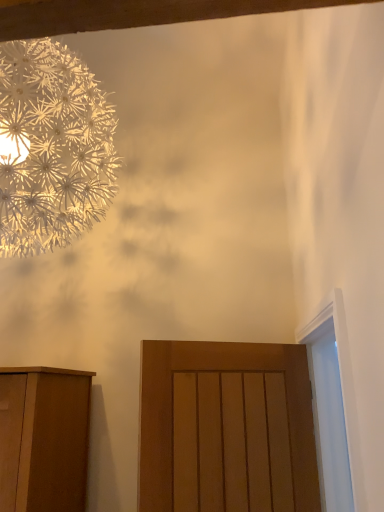
Question: Can we say metallic silver flower at upper left lies outside matte wood door at center?

Choices:
 (A) yes
 (B) no

Answer: (A)

Question: Can you confirm if metallic silver flower at upper left is wider than matte wood door at center?

Choices:
 (A) no
 (B) yes

Answer: (B)

Question: Considering the relative positions of metallic silver flower at upper left and matte wood door at center in the image provided, is metallic silver flower at upper left to the left of matte wood door at center from the viewer's perspective?

Choices:
 (A) no
 (B) yes

Answer: (B)

Question: Could you tell me if metallic silver flower at upper left is turned towards matte wood door at center?

Choices:
 (A) yes
 (B) no

Answer: (B)

Question: Is metallic silver flower at upper left to the right of matte wood door at center from the viewer's perspective?

Choices:
 (A) yes
 (B) no

Answer: (B)

Question: Looking at their shapes, would you say metallic silver flower at upper left is wider or thinner than matte wood door at center?

Choices:
 (A) thin
 (B) wide

Answer: (B)

Question: Visually, is metallic silver flower at upper left positioned to the left or to the right of matte wood door at center?

Choices:
 (A) right
 (B) left

Answer: (B)

Question: From the image's perspective, is metallic silver flower at upper left above or below matte wood door at center?

Choices:
 (A) below
 (B) above

Answer: (B)

Question: Is metallic silver flower at upper left bigger or smaller than matte wood door at center?

Choices:
 (A) small
 (B) big

Answer: (B)

Question: Looking at their shapes, would you say matte wood door at center is wider or thinner than metallic silver flower at upper left?

Choices:
 (A) wide
 (B) thin

Answer: (B)

Question: Would you say matte wood door at center is inside or outside metallic silver flower at upper left?

Choices:
 (A) inside
 (B) outside

Answer: (B)

Question: In the image, is matte wood door at center positioned in front of or behind metallic silver flower at upper left?

Choices:
 (A) behind
 (B) front

Answer: (A)

Question: Is matte wood door at center to the left or to the right of metallic silver flower at upper left in the image?

Choices:
 (A) right
 (B) left

Answer: (A)

Question: Is white glossy door at right wider or thinner than metallic silver flower at upper left?

Choices:
 (A) thin
 (B) wide

Answer: (A)

Question: In terms of size, does white glossy door at right appear bigger or smaller than metallic silver flower at upper left?

Choices:
 (A) small
 (B) big

Answer: (A)